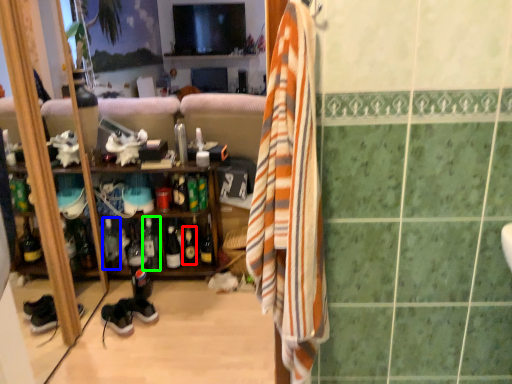
Question: Based on their relative distances, which object is nearer to bottle (highlighted by a red box)? Choose from bottle (highlighted by a blue box) and bottle (highlighted by a green box).

Choices:
 (A) bottle
 (B) bottle

Answer: (B)